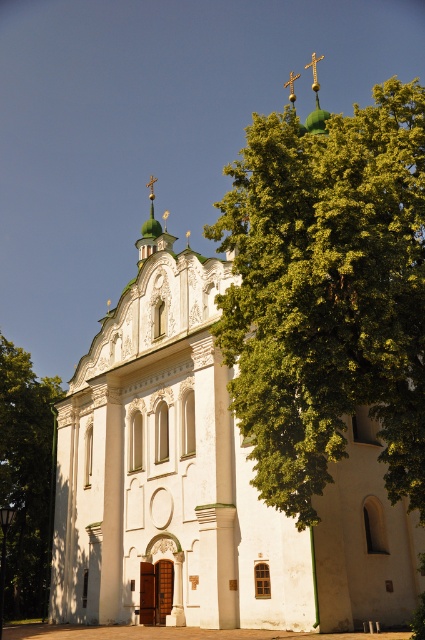
Question: Which point is farther to the camera?

Choices:
 (A) (141, 250)
 (B) (42, 577)

Answer: (B)

Question: Which object appears farthest from the camera in this image?

Choices:
 (A) green leafy tree at left
 (B) white stone church at center

Answer: (A)

Question: Can you confirm if white stone church at center is bigger than gold metallic cross at upper center?

Choices:
 (A) no
 (B) yes

Answer: (A)

Question: Is white stone church at center below green leafy tree at left?

Choices:
 (A) yes
 (B) no

Answer: (B)

Question: Which of these objects is positioned closest to the gold metallic cross at upper center?

Choices:
 (A) white stone church at center
 (B) green leafy tree at left

Answer: (A)

Question: Does white stone church at center have a greater width compared to green leafy tree at left?

Choices:
 (A) no
 (B) yes

Answer: (B)